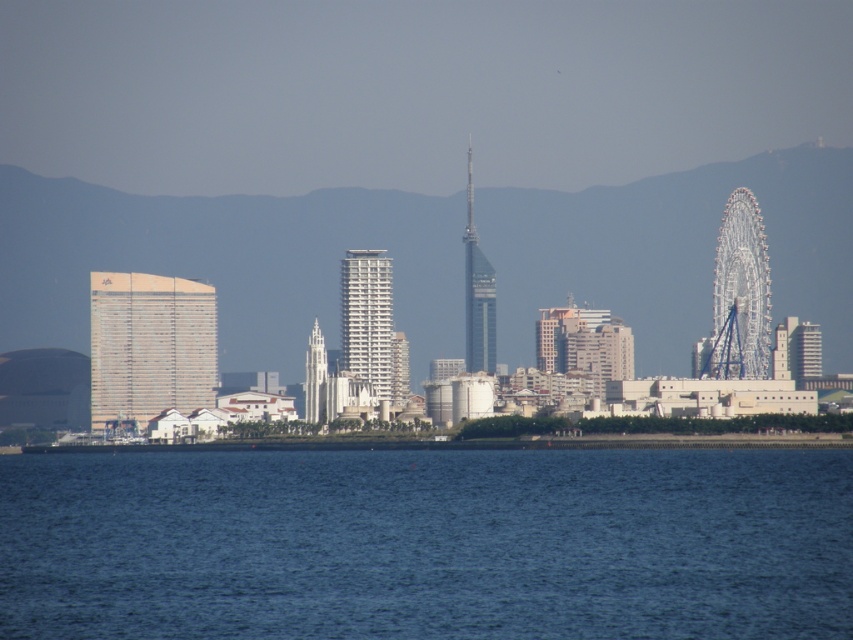
You are a city planner evaluating the coastal area. You need to determine if the blue liquid water at lower center can accommodate a new floating platform that requires a minimum area of 100 square meters. Based on the gold metallic building at left, which has a footprint of 80 square meters, can the water area support the platform?

The blue liquid water at lower center is larger in size than the gold metallic building at left, which has a footprint of 80 square meters. Since the water area is bigger than the building, it can accommodate the floating platform requiring 100 square meters.

You are an architect designing a new observation deck for the city. You want to ensure that the view of the blue liquid water at lower center is unobstructed from the deck. Based on its 2D coordinates, what is the minimum height the deck must be to ensure the water remains visible?

The blue liquid water at lower center is located at coordinates point (427, 544). To ensure visibility, the deck must be at least 0.502 units high to see the water.

You are a tourist standing at the edge of the water in the coastal city. You want to take a photo that includes both the blue liquid water at lower center and the white glossy building at center. Based on their positions, which object should be placed to the right in your photo?

The blue liquid water at lower center should be placed to the right in your photo because it is positioned on the right side of the white glossy building at center.